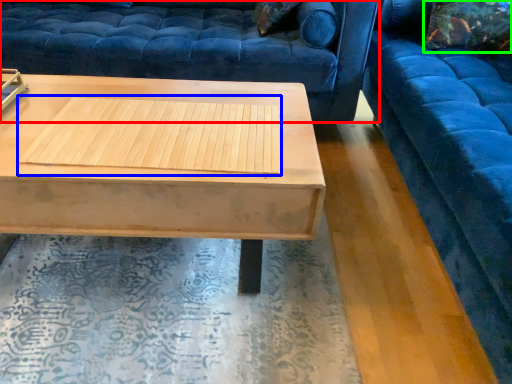
Question: Based on their relative distances, which object is farther from studio couch (highlighted by a red box)? Choose from wood (highlighted by a blue box) and pillow (highlighted by a green box).

Choices:
 (A) wood
 (B) pillow

Answer: (B)